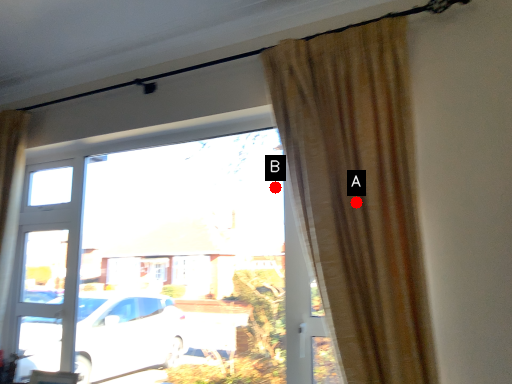
Question: Two points are circled on the image, labeled by A and B beside each circle. Which point is closer to the camera?

Choices:
 (A) A is closer
 (B) B is closer

Answer: (A)